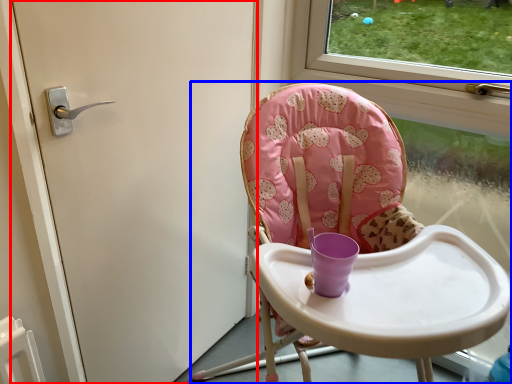
Question: Among these objects, which one is nearest to the camera, door (highlighted by a red box) or chair (highlighted by a blue box)?

Choices:
 (A) door
 (B) chair

Answer: (B)